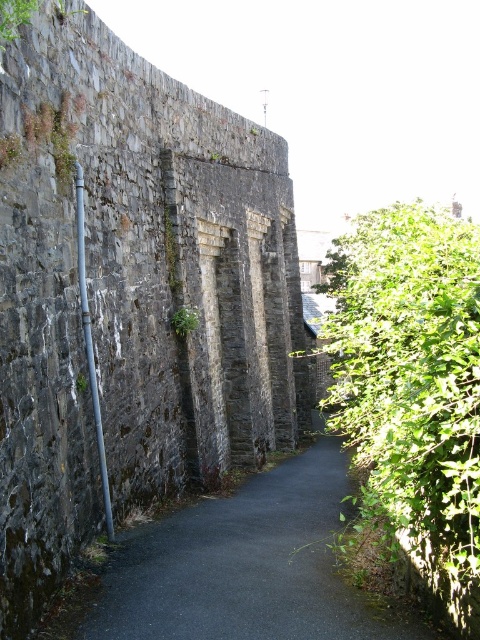
You are standing at the start of the pathway and see the point marked at coordinates [412,387]. What object is located at that point?

The point at coordinates [412,387] corresponds to the green leafy bush at right.

You are a delivery person carrying a large package and need to walk along the dark stone wall at center. If the package is 77 feet long, will it fit between you and the wall without extending beyond the pathway?

The dark stone wall at center is 77.60 feet from viewer, so the package which is 77 feet long will fit between you and the wall without extending beyond the pathway.